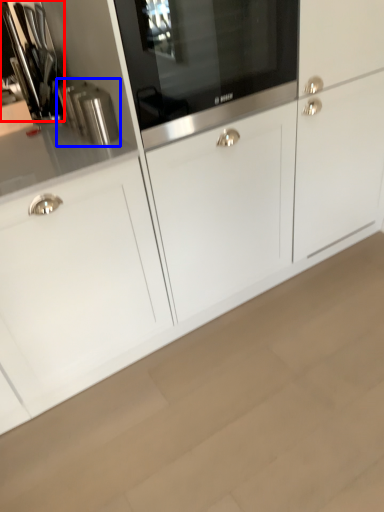
Question: Among these objects, which one is farthest to the camera, appliance (highlighted by a red box) or kitchen appliance (highlighted by a blue box)?

Choices:
 (A) appliance
 (B) kitchen appliance

Answer: (A)